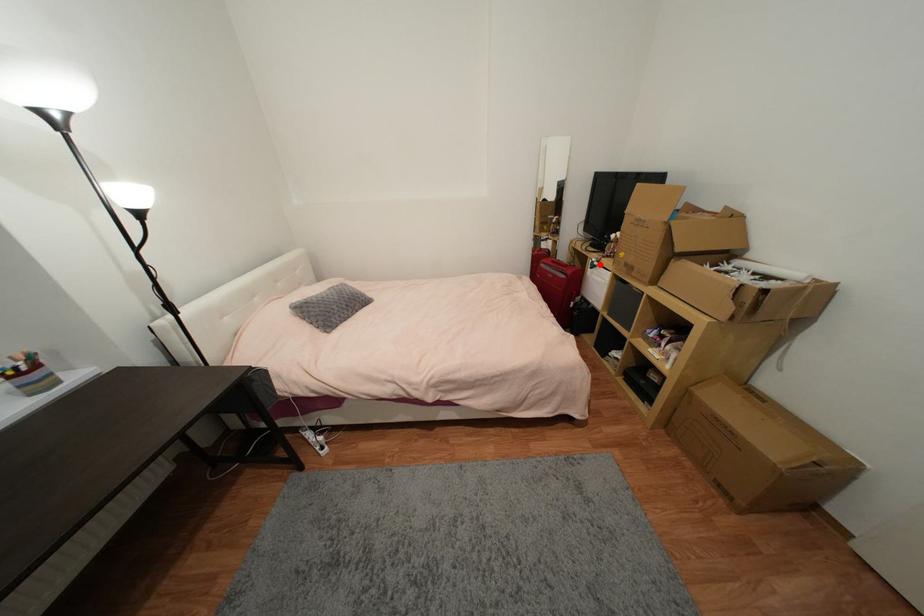
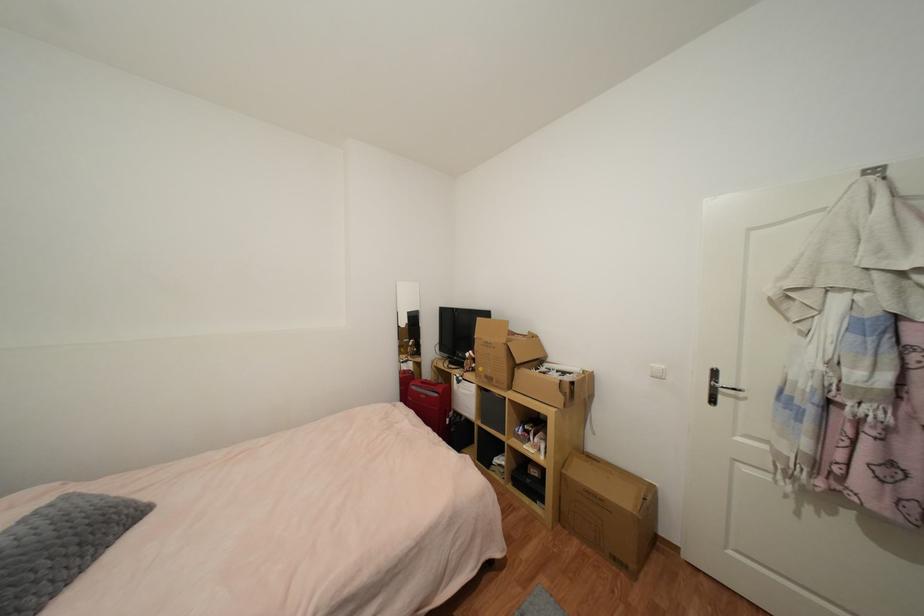
Question: I am providing you with two images of the same scene from different viewpoints. Given a red point in image1, look at the same physical point in image2. Is it:

Choices:
 (A) Closer to the viewpoint
 (B) Farther from the viewpoint

Answer: (B)